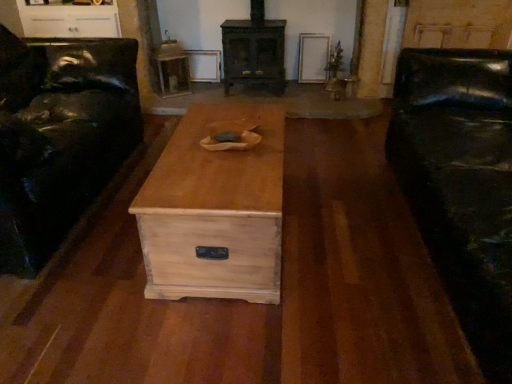
Question: From their relative heights in the image, would you say wooden side table at upper center is taller or shorter than natural wood chest at center?

Choices:
 (A) tall
 (B) short

Answer: (A)

Question: Visually, is wooden side table at upper center positioned to the left or to the right of natural wood chest at center?

Choices:
 (A) left
 (B) right

Answer: (A)

Question: Which object is positioned closest to the natural wood chest at center?

Choices:
 (A) dark brown wood fireplace at center
 (B) black leather couch at right
 (C) matte black leather couch at left
 (D) wooden side table at upper center

Answer: (C)

Question: Which object is the closest to the natural wood chest at center?

Choices:
 (A) dark brown wood fireplace at center
 (B) black leather couch at right
 (C) matte black leather couch at left
 (D) wooden side table at upper center

Answer: (C)